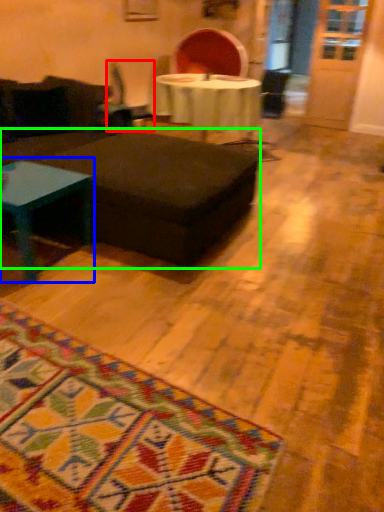
Question: Which object is the farthest from swivel chair (highlighted by a red box)? Choose among these: coffee table (highlighted by a blue box) or table (highlighted by a green box).

Choices:
 (A) coffee table
 (B) table

Answer: (A)